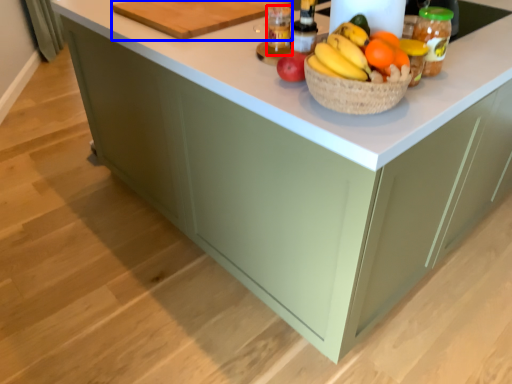
Question: Which object is further to the camera taking this photo, bottle (highlighted by a red box) or cutting board (highlighted by a blue box)?

Choices:
 (A) bottle
 (B) cutting board

Answer: (B)